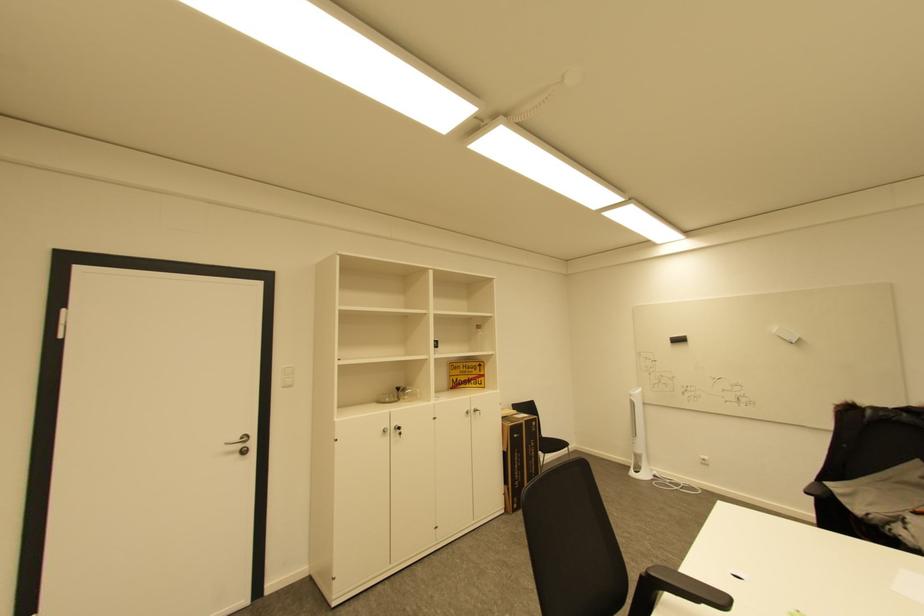
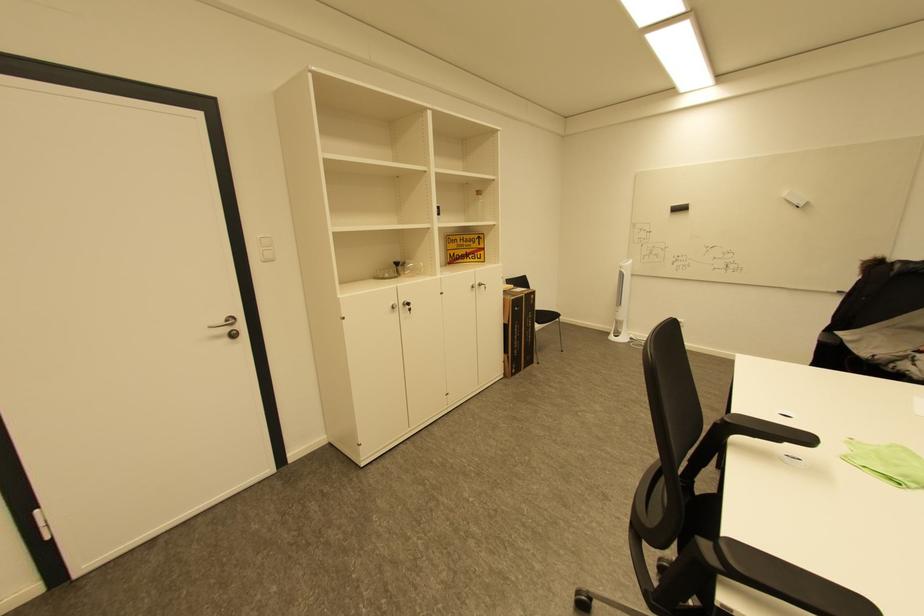
Find the pixel in the second image that matches point 405,390 in the first image.

(403, 264)